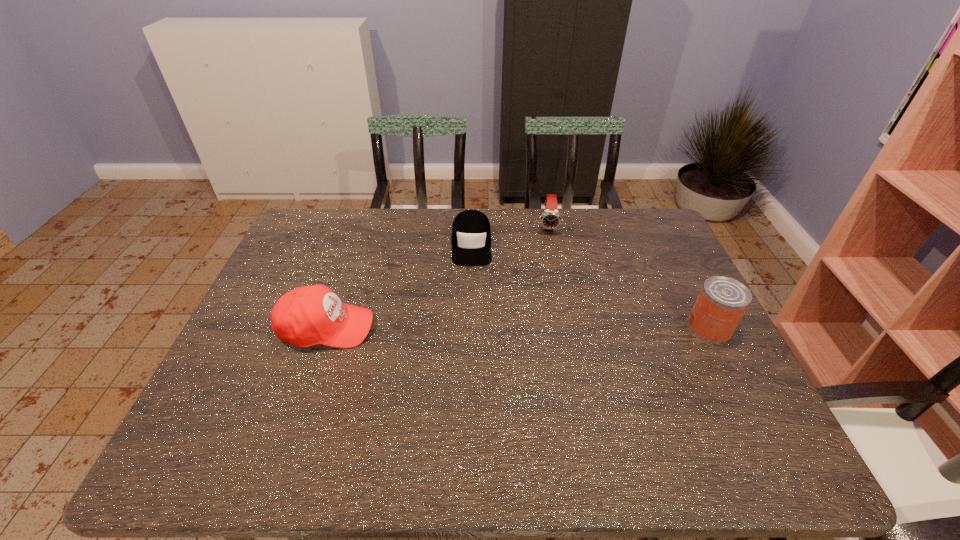
This screenshot has height=540, width=960. I want to click on vacant space at the near left corner, so click(x=218, y=421).

You are a GUI agent. You are given a task and a screenshot of the screen. Output one action in this format:
    pyautogui.click(x=<x>, y=<y>)
    Task: Click on the blank space at the far right corner
    This screenshot has height=540, width=960.
    Given the screenshot: What is the action you would take?
    pyautogui.click(x=651, y=237)

Find the location of a particular element. The height and width of the screenshot is (540, 960). free spot between the watch and the baseball cap is located at coordinates (438, 276).

Locate an element on the screen. Image resolution: width=960 pixels, height=540 pixels. blank region between the second object from right to left and the can is located at coordinates (629, 277).

Locate an element on the screen. vacant space in between the second object from left to right and the watch is located at coordinates (510, 235).

At what (x,y) coordinates should I click in order to perform the action: click on vacant space that's between the rightmost object and the shortest object. Please return your answer as a coordinate pair (x, y). Looking at the image, I should click on (590, 286).

Find the location of a particular element. The image size is (960, 540). free area in between the leftmost object and the second object from left to right is located at coordinates (399, 286).

I want to click on empty location between the shortest object and the rightmost object, so click(x=590, y=286).

You are a GUI agent. You are given a task and a screenshot of the screen. Output one action in this format:
    pyautogui.click(x=<x>, y=<y>)
    Task: Click on the vacant area that lies between the watch and the leftmost object
    The width and height of the screenshot is (960, 540).
    Given the screenshot: What is the action you would take?
    pyautogui.click(x=438, y=276)

Where is `free area in between the leftmost object and the shortest object`? Image resolution: width=960 pixels, height=540 pixels. free area in between the leftmost object and the shortest object is located at coordinates click(399, 286).